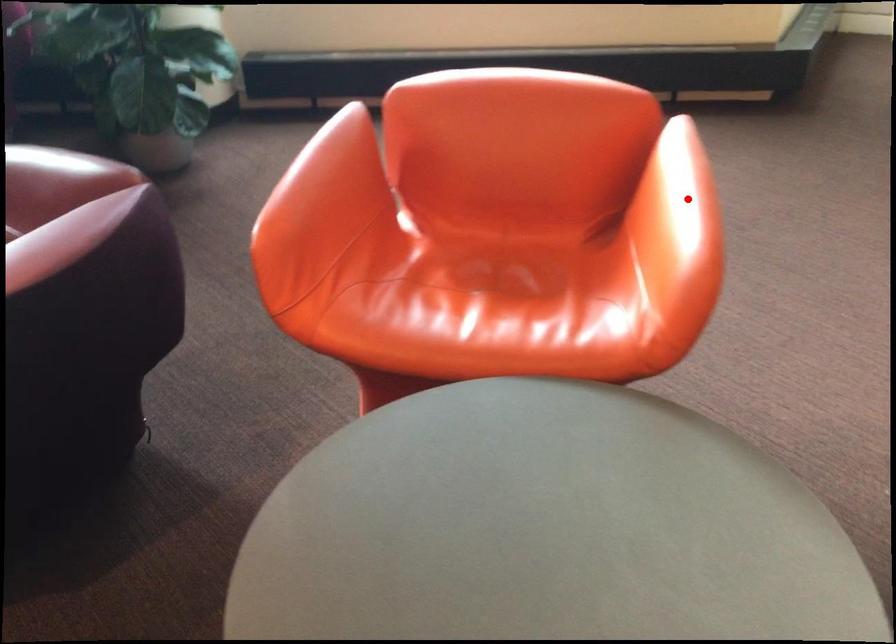
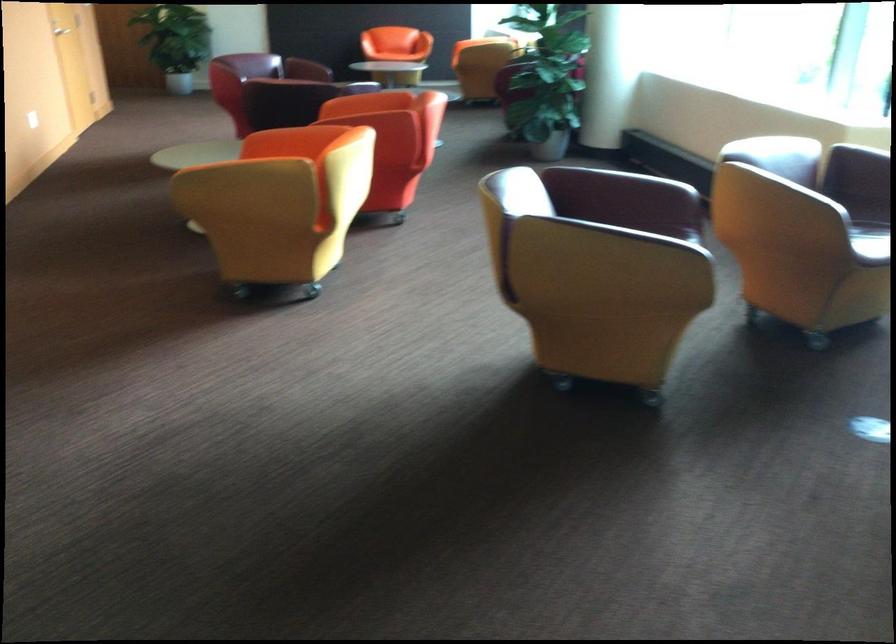
Question: I am providing you with two images of the same scene from different viewpoints. A red point is marked on the first image. At the location where the point appears in image 1, is it still visible in image 2?

Choices:
 (A) Yes
 (B) No

Answer: (B)